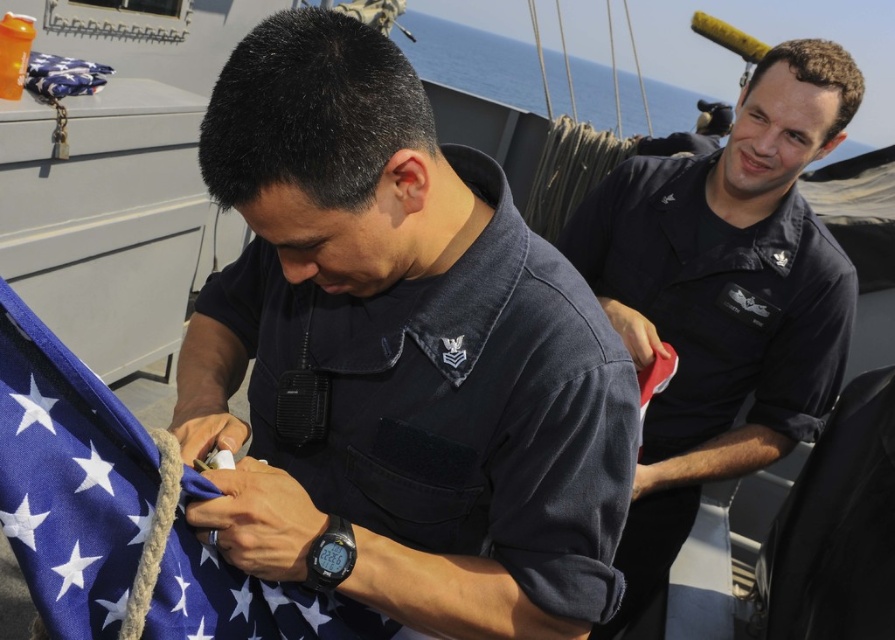
You are standing in front of the ship scene and want to know which point is closer to you. Can you tell me which point is closer between point (x=777, y=193) and point (x=64, y=560)?

Point (x=64, y=560) is closer to you because point (x=777, y=193) is further to the camera than point (x=64, y=560).

You are a sailor on the ship and need to determine if the dark blue uniform at center can be folded and stored in a compartment designed for items narrower than the blue fabric flag at center. Based on their widths, is this possible?

The dark blue uniform at center might be wider than blue fabric flag at center, so it may not fit in the compartment designed for items narrower than the blue fabric flag at center.

In the scene shown: You are on a ship and need to locate the dark blue uniform at upper right and the blue fabric flag at center. According to the scene, which object is positioned to the right of the other?

The dark blue uniform at upper right is positioned to the right of the blue fabric flag at center.